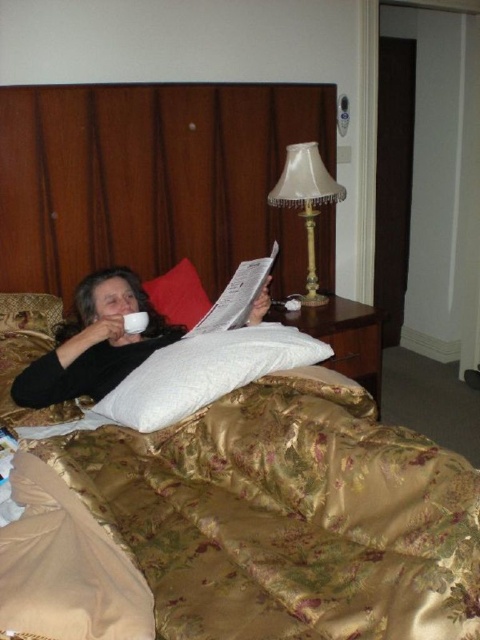
You are a photographer taking a picture of the scene. You need to focus on the white paper magazine at center and the white satin pillow at upper left. Which object should you adjust your focus to first if you want to capture both clearly in the same frame?

The white paper magazine at center is located above the white satin pillow at upper left, so you should focus on the white satin pillow at upper left first to ensure both are in focus as they are stacked vertically.

You are a delivery robot tasked with placing a small package on the bedside table. The package must be placed precisely at the coordinates given in the Objects Description. Can you confirm the location of the white paper magazine at center to ensure the package won not be placed on top of it?

The white paper magazine at center is located at point (x=237, y=296), so the package should be placed elsewhere to avoid overlapping with it.

Looking at this image, you are standing in the room and see the point at coordinates [128,340]. If you want to reach it without moving your feet, can you do so with your outstretched hand?

The point at coordinates [128,340] is 1.97 meters away from you, so no, you cannot reach it with your outstretched hand since the average human arm length is about 0.7 meters.